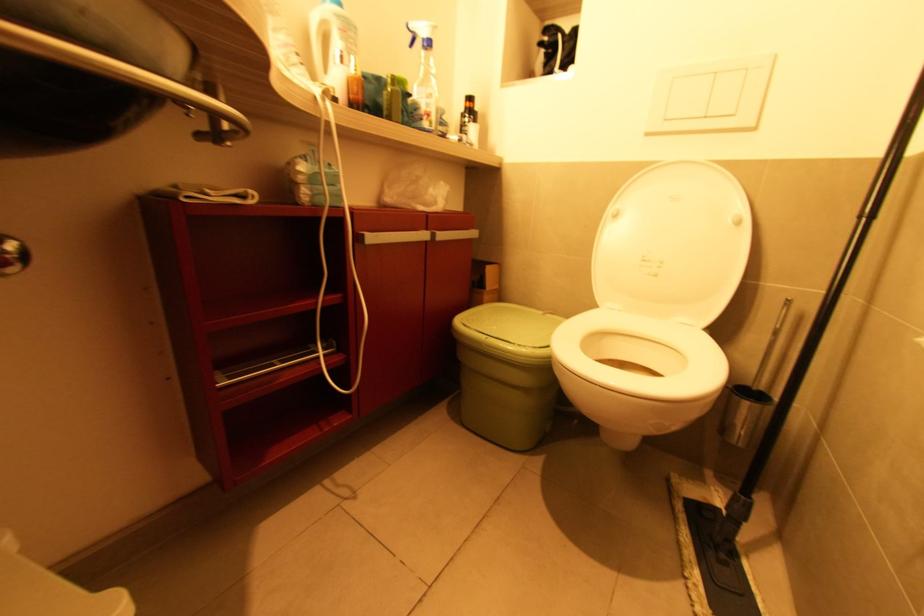
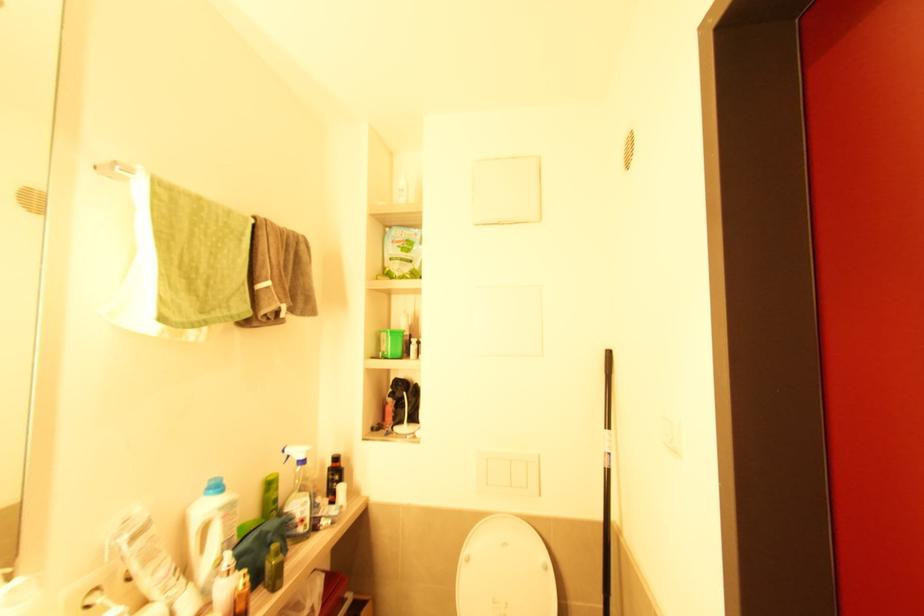
In the second image, find the point that corresponds to the point at 424,121 in the first image.

(298, 527)